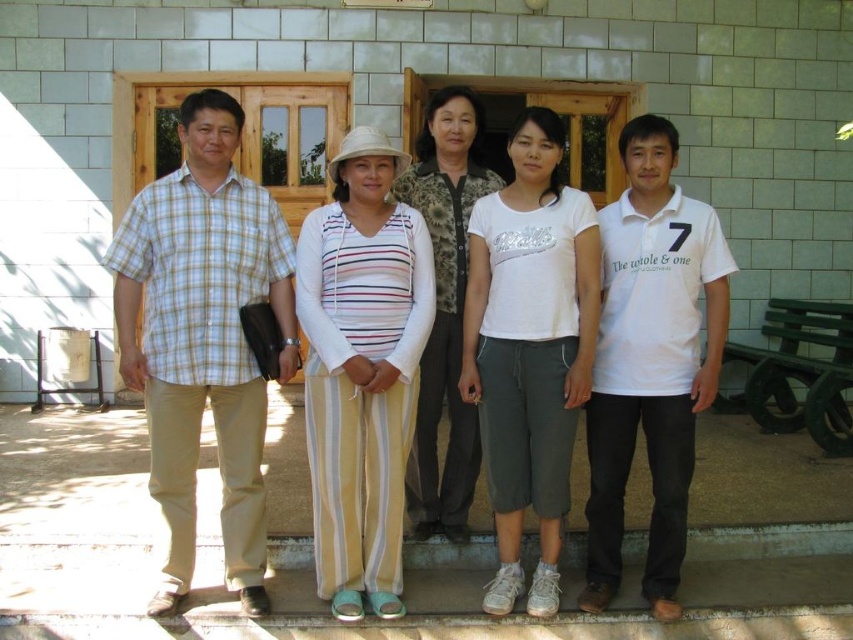
This screenshot has width=853, height=640. What do you see at coordinates (202, 339) in the screenshot? I see `light brown plaid shirt at left` at bounding box center [202, 339].

Is light brown plaid shirt at left further to camera compared to white cotton t-shirt at center?

No.

Which is in front, point (117, 284) or point (532, 324)?

Point (532, 324) is more forward.

Where is `light brown plaid shirt at left`? The width and height of the screenshot is (853, 640). light brown plaid shirt at left is located at coordinates click(202, 339).

The image size is (853, 640). Describe the element at coordinates (650, 360) in the screenshot. I see `white cotton polo shirt at right` at that location.

Is white cotton polo shirt at right bigger than camouflage fabric vest at center?

Incorrect, white cotton polo shirt at right is not larger than camouflage fabric vest at center.

Which is in front, point (631, 321) or point (451, 189)?

Positioned in front is point (631, 321).

Find the location of a particular element. white cotton polo shirt at right is located at coordinates (650, 360).

Is striped fabric top at center below white cotton polo shirt at right?

Yes, striped fabric top at center is below white cotton polo shirt at right.

In the scene shown: Who is more distant from viewer, (370, 291) or (680, 452)?

Positioned behind is point (370, 291).

Locate an element on the screen. Image resolution: width=853 pixels, height=640 pixels. striped fabric top at center is located at coordinates (361, 371).